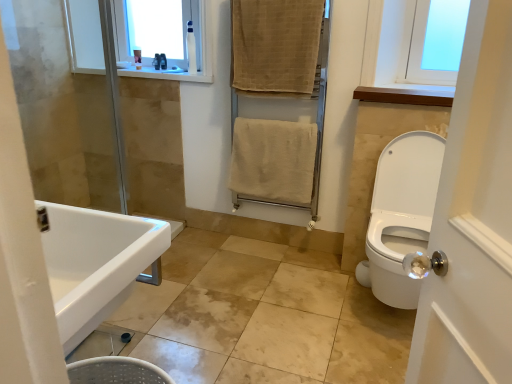
At what (x,y) coordinates should I click in order to perform the action: click on blank space situated above beige cotton towel at center, which appears as the 2th bath towel when viewed from the top (from a real-world perspective). Please return your answer as a coordinate pair (x, y). Looking at the image, I should click on (272, 122).